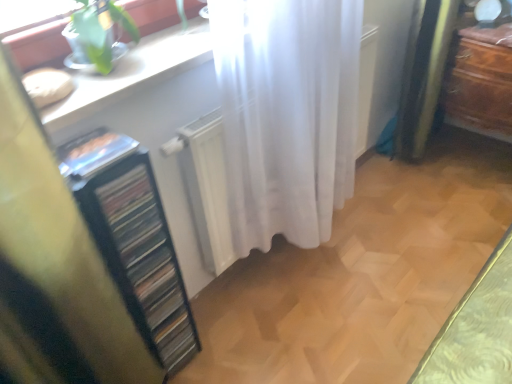
The height and width of the screenshot is (384, 512). In order to click on free space in front of brown wooden dresser at right in this screenshot , I will do `click(477, 210)`.